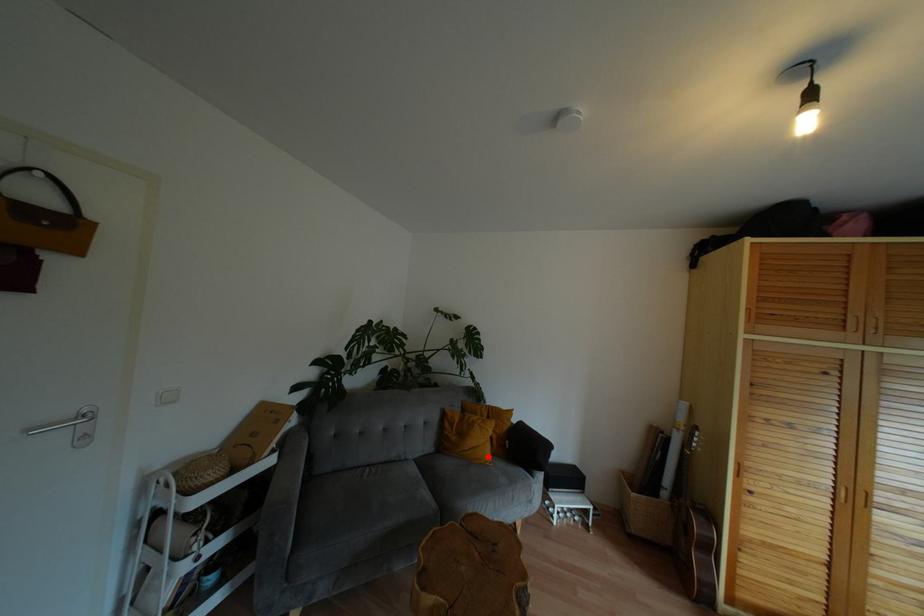
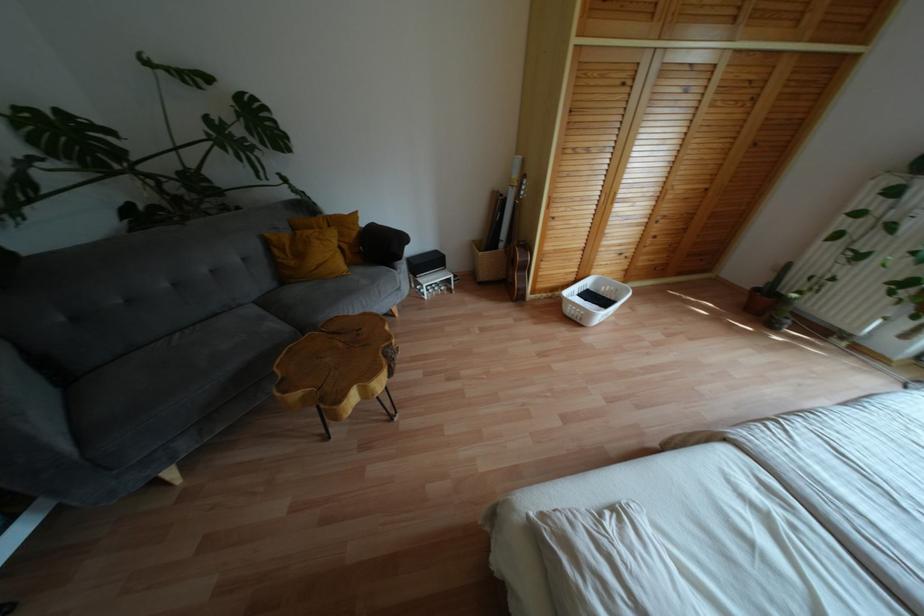
Question: I am providing you with two images of the same scene from different viewpoints. A red point is shown in image1. For the corresponding object point in image2, is it positioned nearer or farther from the camera?

Choices:
 (A) Nearer
 (B) Farther

Answer: (A)